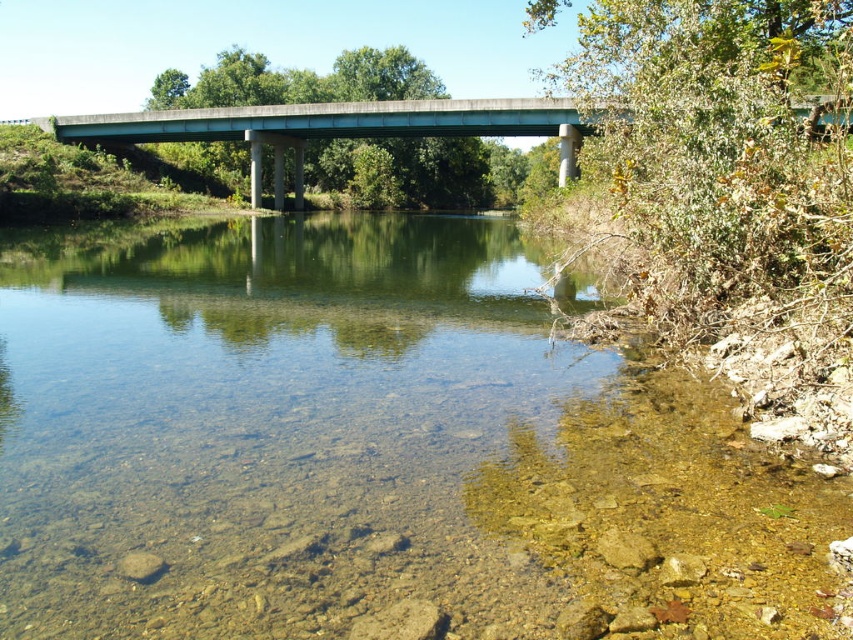
Does clear gravel river at center lie behind concrete bridge at center?

That is False.

What do you see at coordinates (367, 448) in the screenshot? I see `clear gravel river at center` at bounding box center [367, 448].

Which is in front, point (419, 296) or point (564, 179)?

Point (419, 296) is in front.

I want to click on clear gravel river at center, so click(x=367, y=448).